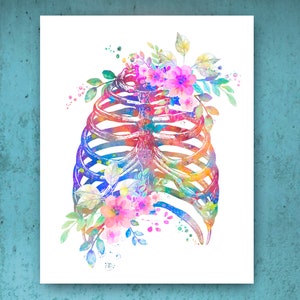
Locate an element on the screen. The width and height of the screenshot is (300, 300). white canvas is located at coordinates (241, 139).